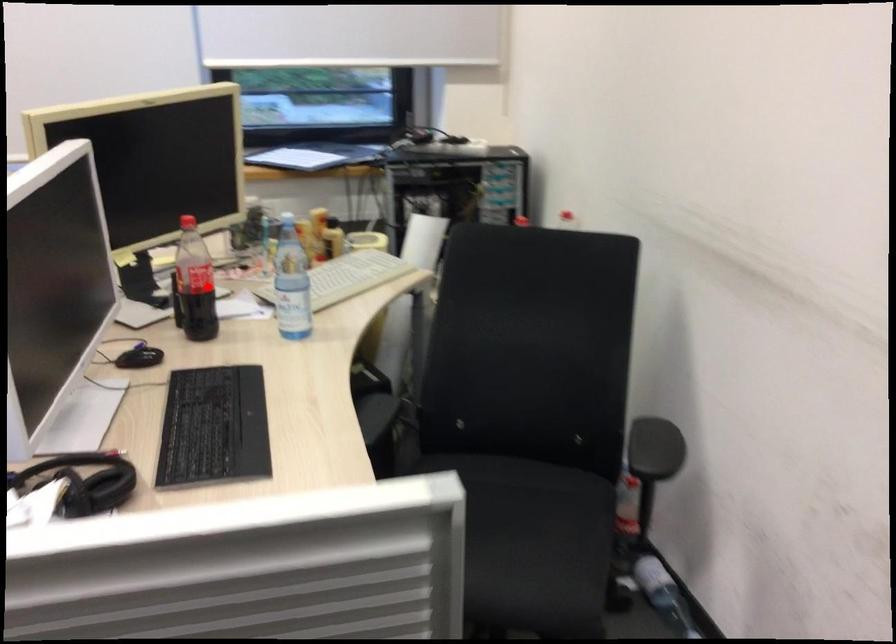
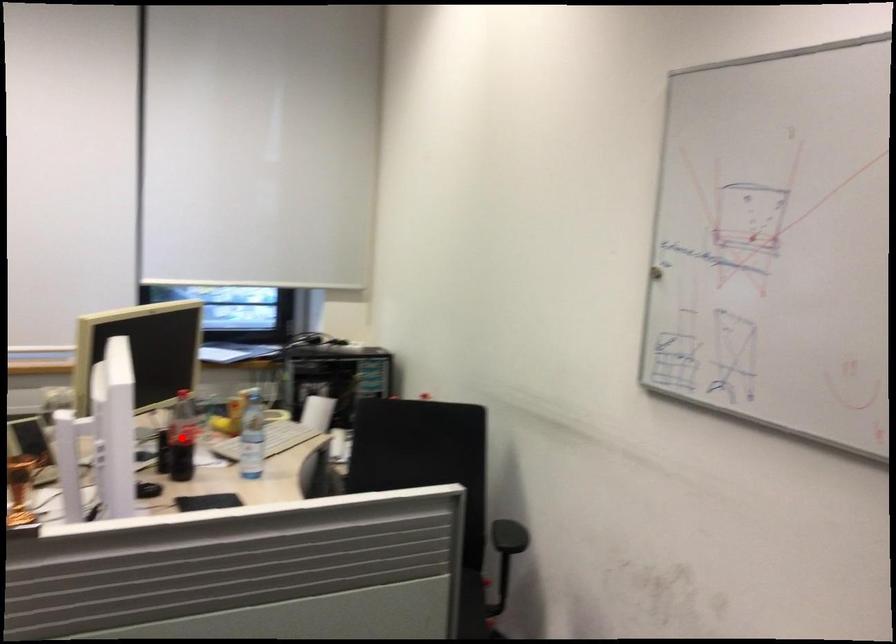
I am providing you with two images of the same scene from different viewpoints. A red point is marked on the first image and another point is marked on the second image. Does the point marked in image1 correspond to the same location as the one in image2?

Yes